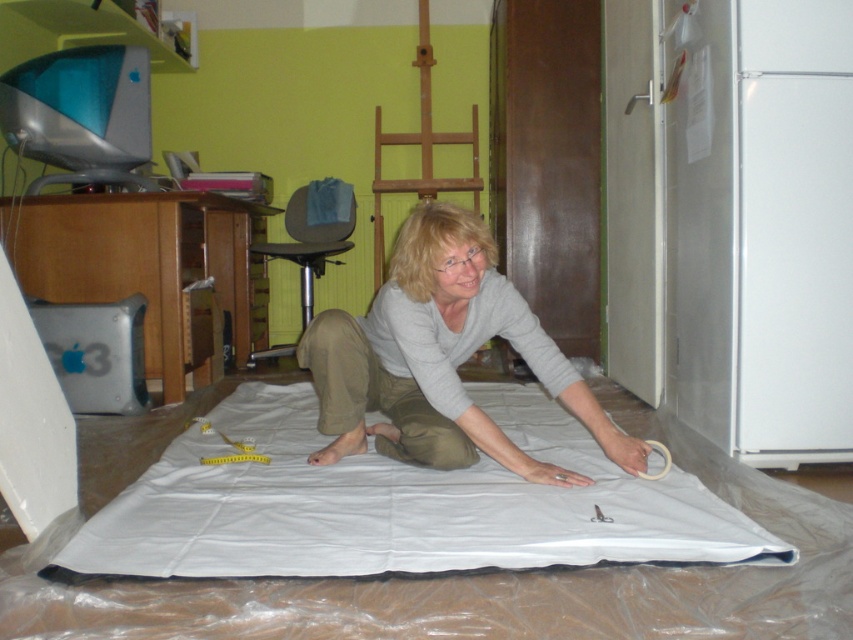
Identify the location of white fabric at center. The image size is (853, 640). (398, 504).

Between white fabric at center and gray cotton shirt at center, which one appears on the right side from the viewer's perspective?

Positioned to the right is gray cotton shirt at center.

Who is more distant from viewer, (488, 512) or (476, 433)?

Positioned behind is point (476, 433).

Identify the location of white fabric at center. (398, 504).